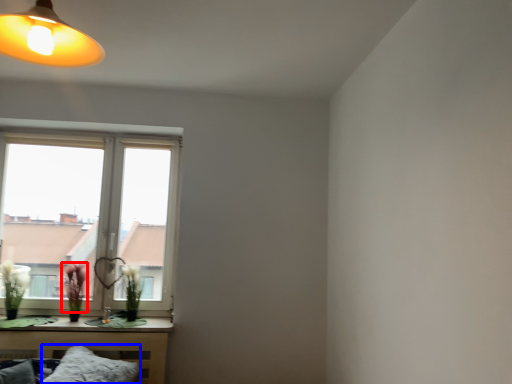
Question: Which point is further to the camera, flower (highlighted by a red box) or pillow (highlighted by a blue box)?

Choices:
 (A) flower
 (B) pillow

Answer: (A)